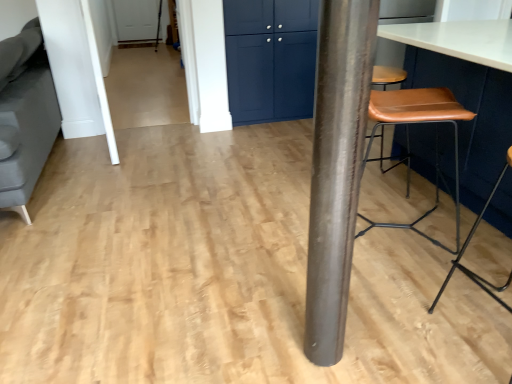
Question: Can you confirm if brown leather stool at right is shorter than matte blue cabinet at upper center?

Choices:
 (A) no
 (B) yes

Answer: (B)

Question: From the image's perspective, is brown leather stool at right located beneath matte blue cabinet at upper center?

Choices:
 (A) no
 (B) yes

Answer: (B)

Question: Does brown leather stool at right lie in front of matte blue cabinet at upper center?

Choices:
 (A) yes
 (B) no

Answer: (A)

Question: Is brown leather stool at right touching matte blue cabinet at upper center?

Choices:
 (A) yes
 (B) no

Answer: (B)

Question: Does brown leather stool at right have a greater width compared to matte blue cabinet at upper center?

Choices:
 (A) yes
 (B) no

Answer: (A)

Question: In terms of height, does matte blue cabinet at upper center look taller or shorter compared to brown leather stool at right?

Choices:
 (A) short
 (B) tall

Answer: (B)

Question: Is point (312, 52) closer or farther from the camera than point (410, 127)?

Choices:
 (A) farther
 (B) closer

Answer: (A)

Question: Do you think matte blue cabinet at upper center is within brown leather stool at right, or outside of it?

Choices:
 (A) inside
 (B) outside

Answer: (B)

Question: Looking at their shapes, would you say matte blue cabinet at upper center is wider or thinner than brown leather stool at right?

Choices:
 (A) thin
 (B) wide

Answer: (A)

Question: Considering the positions of shiny metallic pole at center and brown leather stool at right in the image, is shiny metallic pole at center taller or shorter than brown leather stool at right?

Choices:
 (A) tall
 (B) short

Answer: (A)

Question: Relative to brown leather stool at right, is shiny metallic pole at center in front or behind?

Choices:
 (A) behind
 (B) front

Answer: (B)

Question: From a real-world perspective, is shiny metallic pole at center positioned above or below brown leather stool at right?

Choices:
 (A) below
 (B) above

Answer: (B)

Question: Is point (x=328, y=43) positioned closer to the camera than point (x=490, y=91)?

Choices:
 (A) closer
 (B) farther

Answer: (A)

Question: Is white smooth door at upper left to the left or to the right of matte blue cabinet at upper center in the image?

Choices:
 (A) left
 (B) right

Answer: (A)

Question: Is white smooth door at upper left spatially inside matte blue cabinet at upper center, or outside of it?

Choices:
 (A) outside
 (B) inside

Answer: (A)